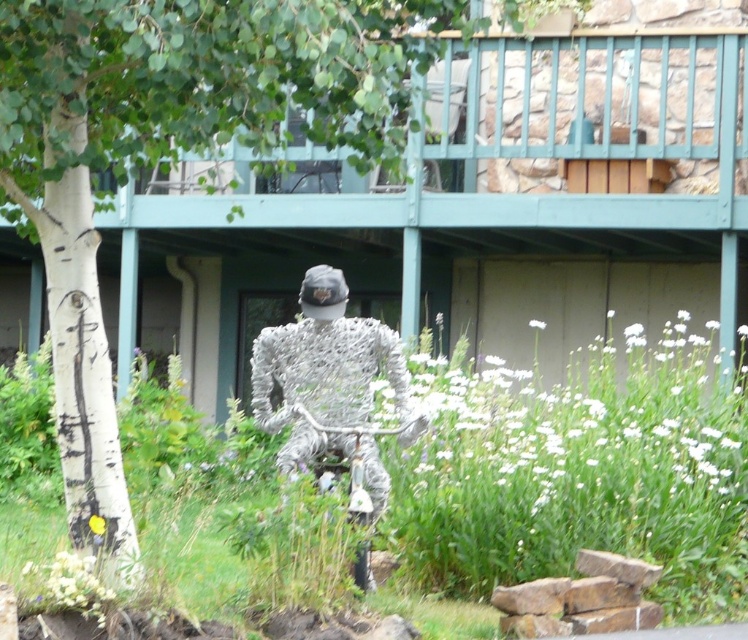
Question: Which object appears farthest from the camera in this image?

Choices:
 (A) white bark tree at center
 (B) silver wire sculpture at center

Answer: (B)

Question: Can you confirm if white bark tree at center is positioned to the right of silver wire sculpture at center?

Choices:
 (A) no
 (B) yes

Answer: (A)

Question: Which point is closer to the camera taking this photo?

Choices:
 (A) (61, 234)
 (B) (263, 378)

Answer: (A)

Question: Is white bark tree at center wider than silver wire sculpture at center?

Choices:
 (A) yes
 (B) no

Answer: (A)

Question: Can you confirm if white bark tree at center is positioned above silver wire sculpture at center?

Choices:
 (A) no
 (B) yes

Answer: (B)